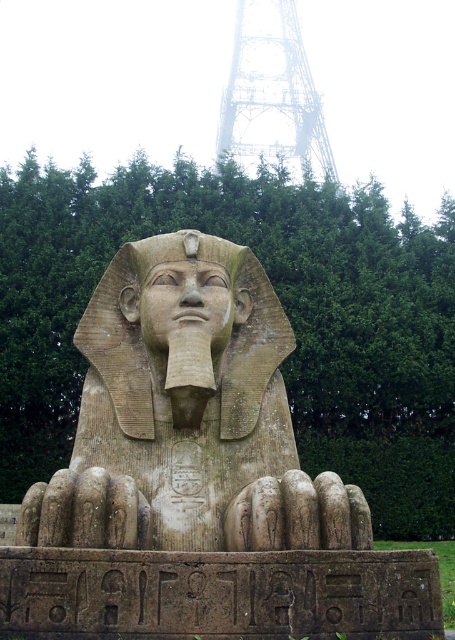
Question: Which of these objects is positioned closest to the matte stone nose at center?

Choices:
 (A) metallic lattice structure at upper center
 (B) stone statue head at center
 (C) stone statue at center

Answer: (B)

Question: Is stone statue at center wider than metallic lattice structure at upper center?

Choices:
 (A) no
 (B) yes

Answer: (A)

Question: Which object appears farthest from the camera in this image?

Choices:
 (A) stone statue at center
 (B) matte stone nose at center
 (C) metallic lattice structure at upper center
 (D) stone statue head at center

Answer: (C)

Question: Considering the real-world distances, which object is farthest from the stone statue head at center?

Choices:
 (A) matte stone nose at center
 (B) stone statue at center

Answer: (B)

Question: Does stone statue at center have a larger size compared to metallic lattice structure at upper center?

Choices:
 (A) yes
 (B) no

Answer: (B)

Question: Where is stone statue at center located in relation to metallic lattice structure at upper center in the image?

Choices:
 (A) above
 (B) below

Answer: (B)